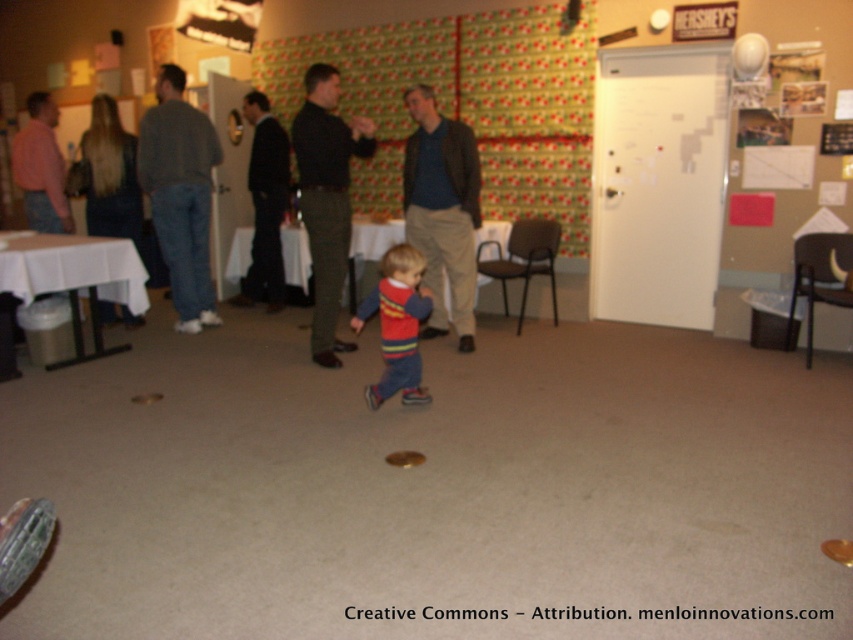
Is matte brown jacket at center taller than dark suit at center?

No, matte brown jacket at center is not taller than dark suit at center.

Looking at this image, is matte brown jacket at center above dark suit at center?

No.

This screenshot has width=853, height=640. What do you see at coordinates (442, 209) in the screenshot?
I see `matte brown jacket at center` at bounding box center [442, 209].

At what (x,y) coordinates should I click in order to perform the action: click on matte brown jacket at center. Please return your answer as a coordinate pair (x, y). Looking at the image, I should click on (442, 209).

Consider the image. Does gray sweater at left have a lesser width compared to matte red sweater at center?

No, gray sweater at left is not thinner than matte red sweater at center.

Between gray sweater at left and matte red sweater at center, which one is positioned higher?

gray sweater at left

Identify the location of gray sweater at left. The height and width of the screenshot is (640, 853). (180, 195).

Is dark green textured pants at center behind dark suit at center?

That is False.

What do you see at coordinates (326, 198) in the screenshot? The width and height of the screenshot is (853, 640). I see `dark green textured pants at center` at bounding box center [326, 198].

Identify the location of dark green textured pants at center. (326, 198).